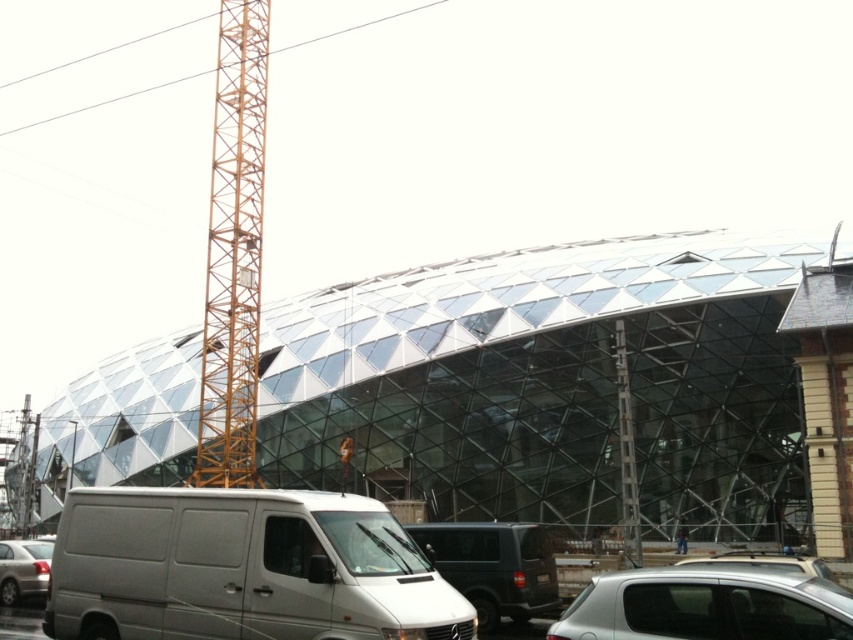
You are a delivery driver needing to park your truck which is 2.5 meters tall. You see the white matte van at lower left and the matte black van at center. Which van is taller and can your truck pass under both?

The white matte van at lower left is taller than the matte black van at center. Since your truck is 2.5 meters tall, you need to check the height of both vans. However, the exact heights are not provided, so it is uncertain if your truck can pass under them.

You are standing in front of the construction site and want to take a photo of the building. There are two points marked on your camera screen at coordinates point (x=677, y=634) and point (x=9, y=568). Which point should you focus on to ensure the closer object is in sharp focus?

You should focus on point (x=677, y=634) because it is closer to the camera than point (x=9, y=568), ensuring the closer object is in sharp focus.